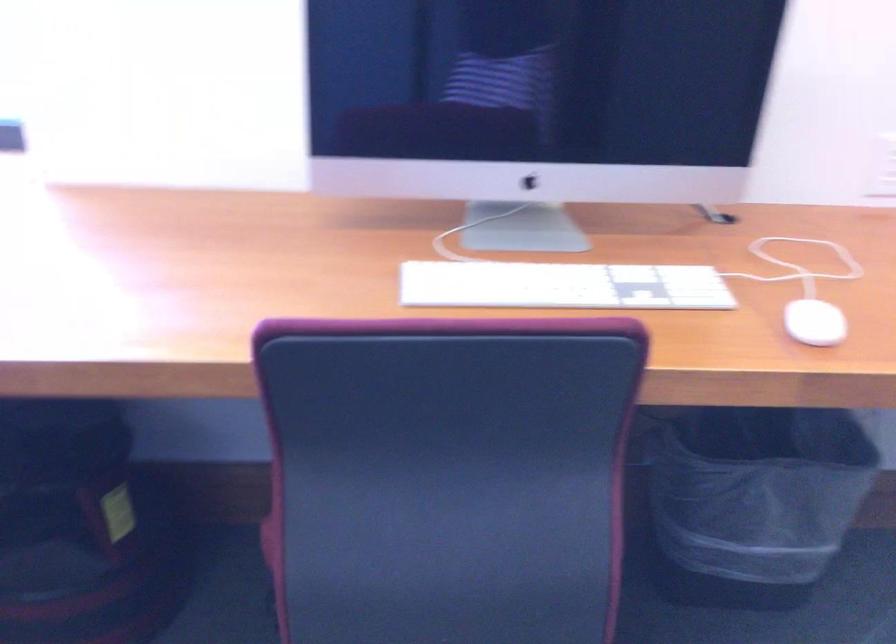
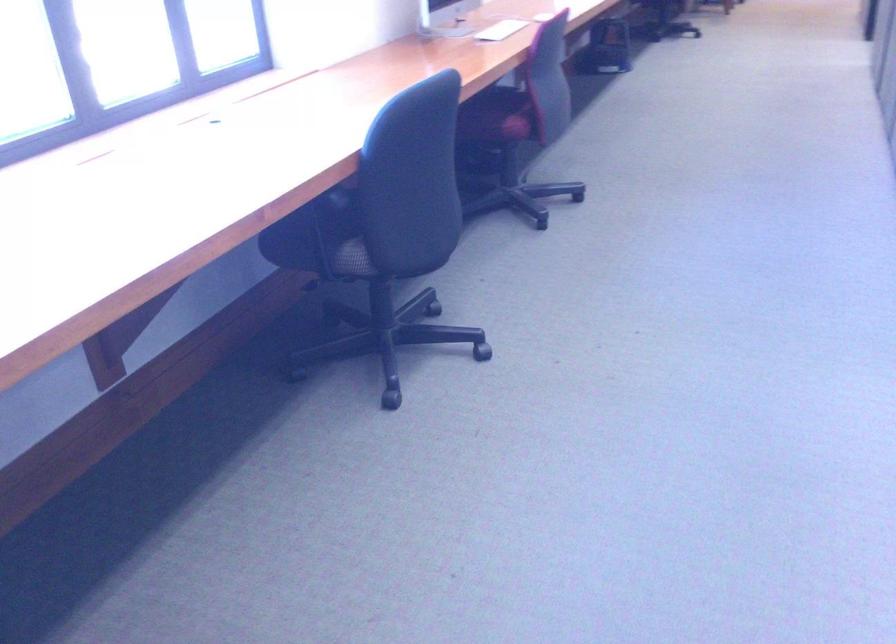
Find the pixel in the second image that matches point (461, 292) in the first image.

(501, 30)